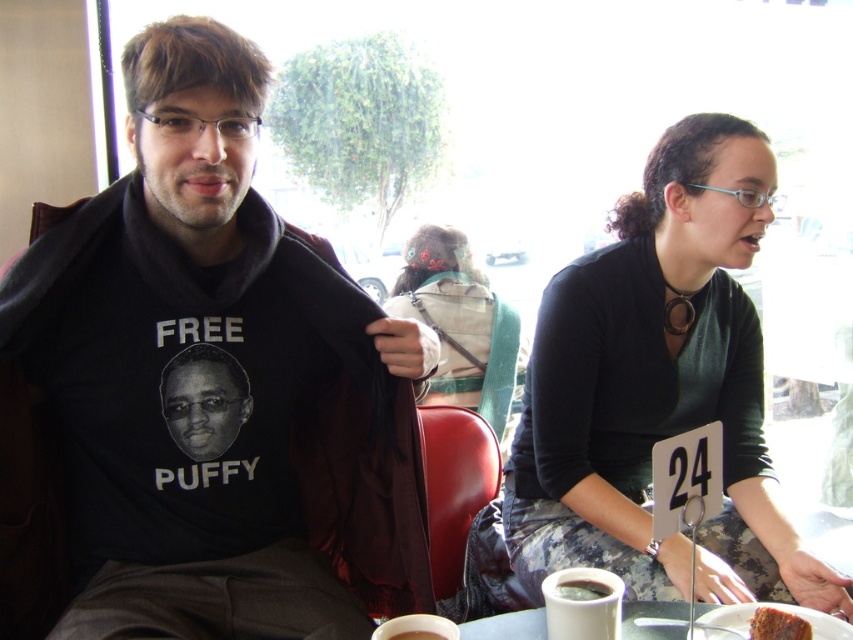
You are a barista trying to deliver the white ceramic cup at lower center to the customer sitting at the table. The customer is seated between the two people in the scene. Which direction should you place the cup to ensure it reaches the correct person?

The white ceramic cup at lower center should be placed at point (582, 604) to ensure it reaches the correct person.

You are a barista at the cafe and need to place both the white ceramic cup at lower center and the white ceramic plate at lower center on a shelf that can only hold items up to 15 cm in height. The cup is 10 cm tall and the plate is 8 cm tall. Can both items fit on the shelf?

Both items can fit on the shelf since the white ceramic cup at lower center is 10 cm tall and the white ceramic plate at lower center is 8 cm tall, both under the 15 cm height limit.